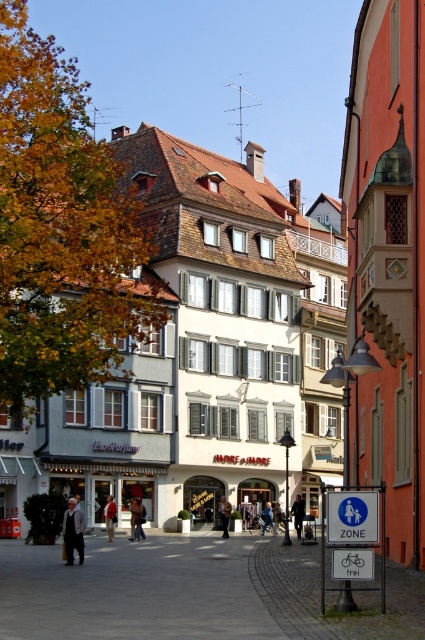
Question: Which point is closer to the camera?

Choices:
 (A) blue denim jacket at center
 (B) light gray fabric jacket at lower left
 (C) red leather jacket at center

Answer: (B)

Question: Does red leather jacket at center appear under blue denim jacket at center?

Choices:
 (A) no
 (B) yes

Answer: (A)

Question: Which point is farther to the camera?

Choices:
 (A) red leather jacket at center
 (B) light gray fabric jacket at lower left
 (C) dark gray jacket at center

Answer: (C)

Question: Does dark gray jacket at center appear on the right side of blue denim jacket at center?

Choices:
 (A) yes
 (B) no

Answer: (B)

Question: Can you confirm if light gray fabric jacket at lower left is smaller than red leather jacket at center?

Choices:
 (A) yes
 (B) no

Answer: (B)

Question: Which object appears farthest from the camera in this image?

Choices:
 (A) blue denim jacket at center
 (B) dark gray suit at center
 (C) dark gray jacket at center
 (D) light gray fabric jacket at lower left

Answer: (A)